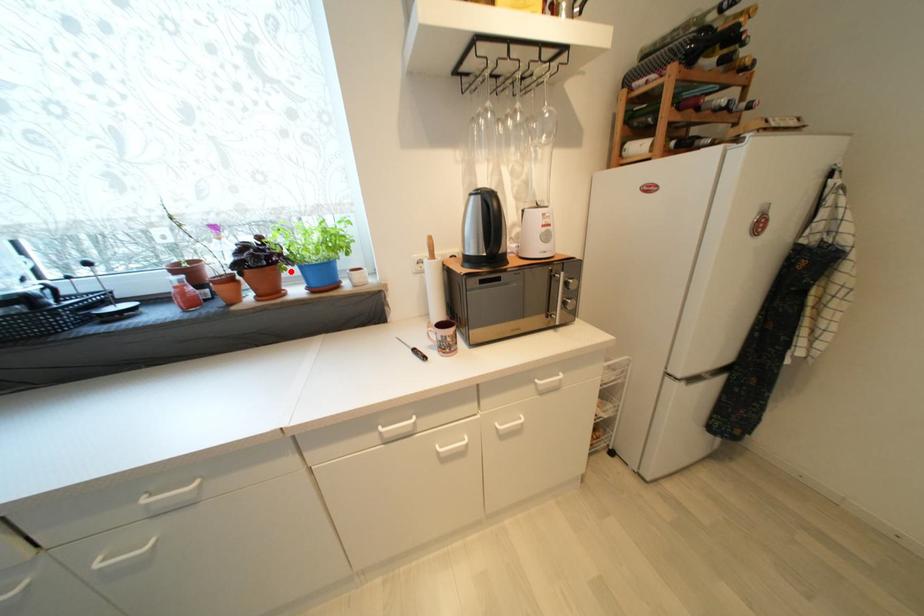
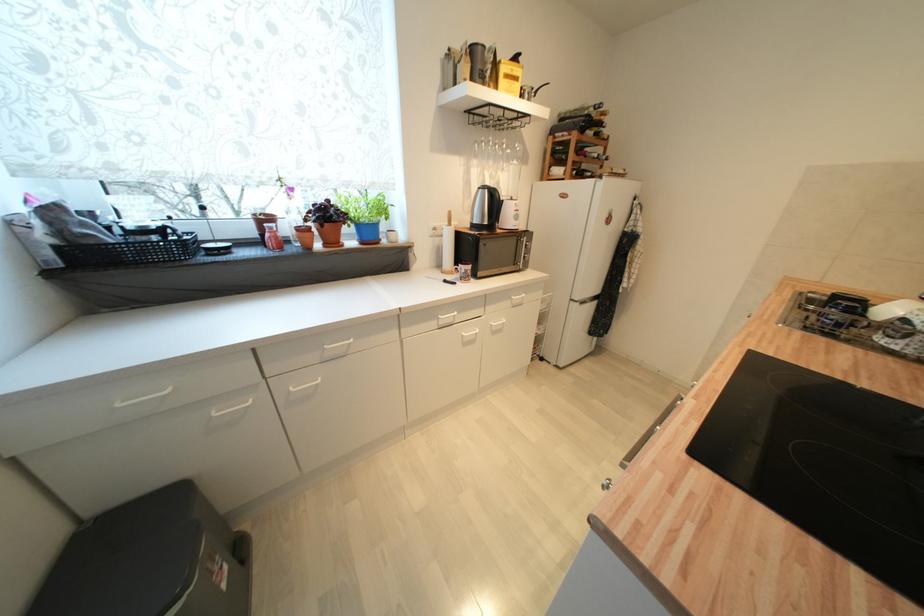
In the second image, find the point that corresponds to the highlighted location in the first image.

(354, 228)